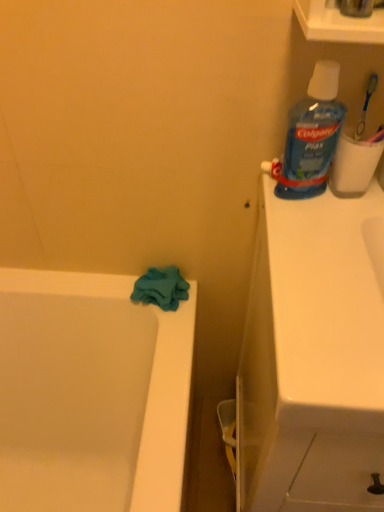
You are a GUI agent. You are given a task and a screenshot of the screen. Output one action in this format:
    pyautogui.click(x=<x>, y=<y>)
    Task: Click on the vacant space in front of blue translucent plastic mouthwash at upper right
    This screenshot has width=384, height=512.
    Given the screenshot: What is the action you would take?
    pyautogui.click(x=317, y=246)